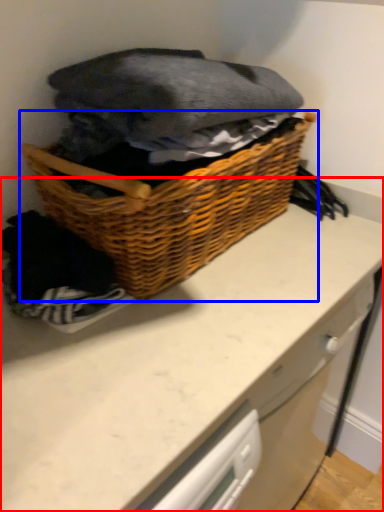
Question: Among these objects, which one is nearest to the camera, counter (highlighted by a red box) or picnic basket (highlighted by a blue box)?

Choices:
 (A) counter
 (B) picnic basket

Answer: (B)